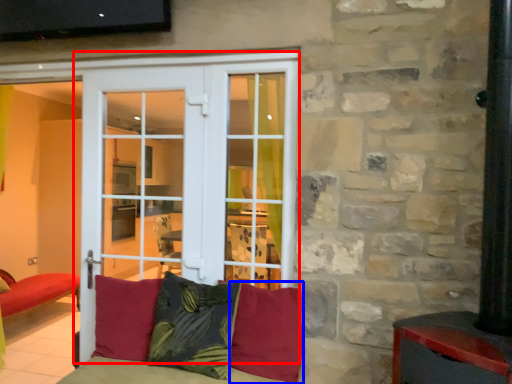
Question: Which point is further to the camera, door (highlighted by a red box) or pillow (highlighted by a blue box)?

Choices:
 (A) door
 (B) pillow

Answer: (A)